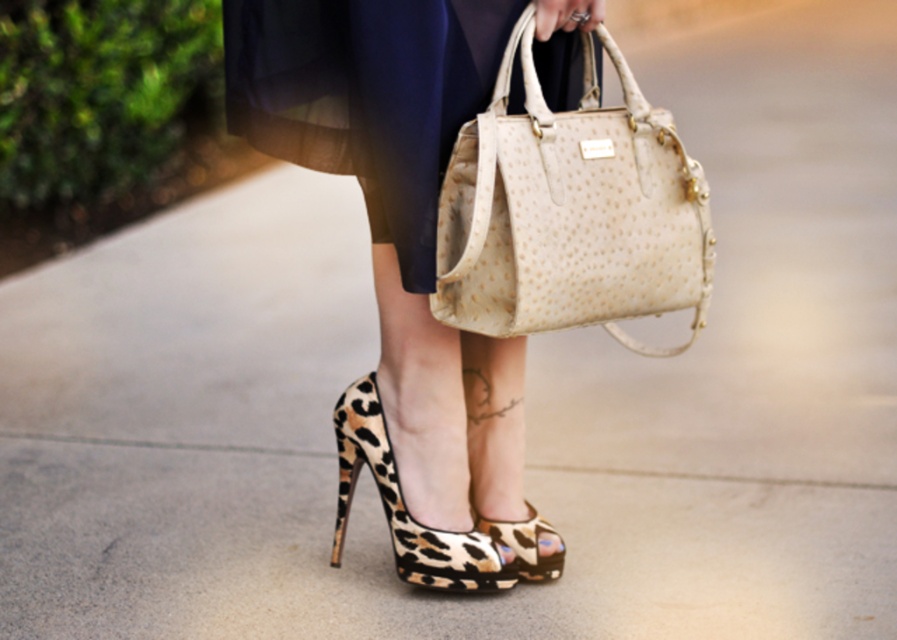
Is leather textured bag at center positioned before navy blue fabric dress at center?

No, it is not.

Image resolution: width=897 pixels, height=640 pixels. Find the location of `leather textured bag at center`. leather textured bag at center is located at coordinates (570, 211).

I want to click on leather textured bag at center, so click(570, 211).

Does leopard print heels at center have a greater width compared to leopard print fabric high-heeled shoe at lower center?

Correct, the width of leopard print heels at center exceeds that of leopard print fabric high-heeled shoe at lower center.

Who is higher up, leopard print heels at center or leopard print fabric high-heeled shoe at lower center?

A: leopard print heels at center

Is point (340, 140) farther from viewer compared to point (525, 541)?

No, it is not.

At what (x,y) coordinates should I click in order to perform the action: click on leopard print heels at center. Please return your answer as a coordinate pair (x, y). The width and height of the screenshot is (897, 640). Looking at the image, I should click on (397, 252).

Between leather textured bag at center and leopard print suede sandal at lower center, which one has less height?

With less height is leopard print suede sandal at lower center.

Who is more forward, (471, 156) or (458, 552)?

Point (471, 156) is in front.

Identify the location of leather textured bag at center. Image resolution: width=897 pixels, height=640 pixels. (570, 211).